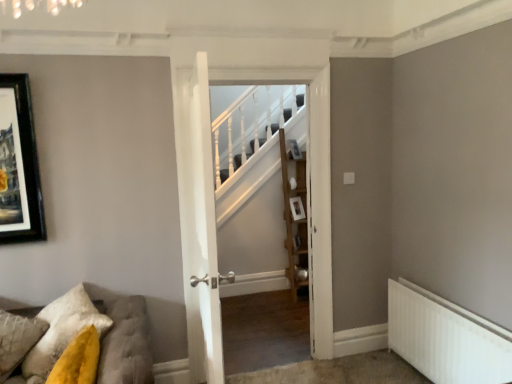
This screenshot has height=384, width=512. Find the location of `free point behind white wooden door at center, which is the 1th door in back-to-front order`. free point behind white wooden door at center, which is the 1th door in back-to-front order is located at coordinates (251, 334).